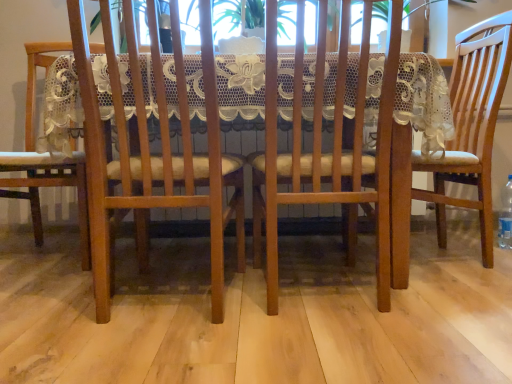
You are a GUI agent. You are given a task and a screenshot of the screen. Output one action in this format:
    pyautogui.click(x=<x>, y=<y>)
    Task: Click on the vacant space in front of wooden chair at center, which is the 3th chair in right-to-left order
    Image resolution: width=512 pixels, height=384 pixels.
    Given the screenshot: What is the action you would take?
    pyautogui.click(x=170, y=349)